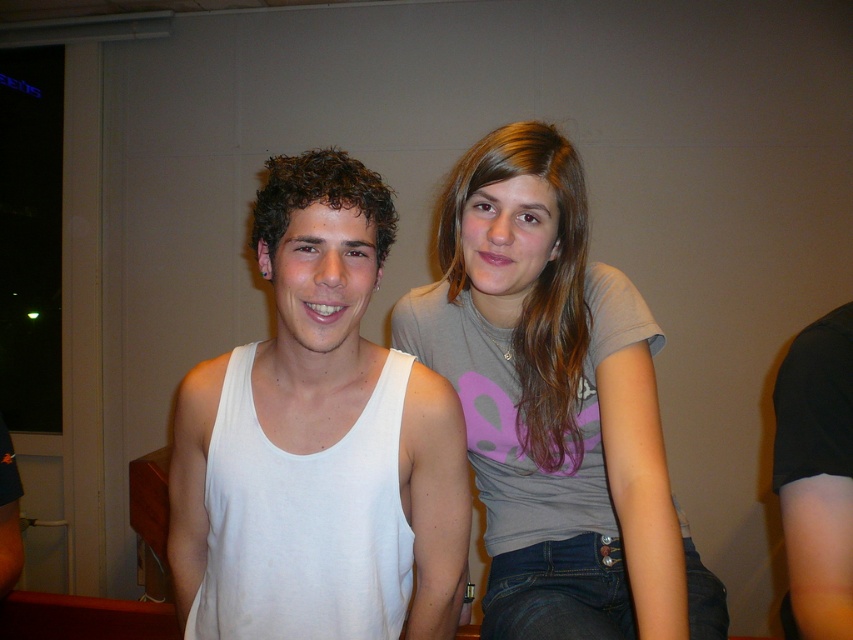
Does white matte tank top at center appear on the left side of gray matte t-shirt at upper right?

Yes, white matte tank top at center is to the left of gray matte t-shirt at upper right.

Who is lower down, white matte tank top at center or gray matte t-shirt at upper right?

Positioned lower is white matte tank top at center.

You are a GUI agent. You are given a task and a screenshot of the screen. Output one action in this format:
    pyautogui.click(x=<x>, y=<y>)
    Task: Click on the white matte tank top at center
    The height and width of the screenshot is (640, 853).
    Given the screenshot: What is the action you would take?
    pyautogui.click(x=318, y=442)

Find the location of a particular element. white matte tank top at center is located at coordinates tap(318, 442).